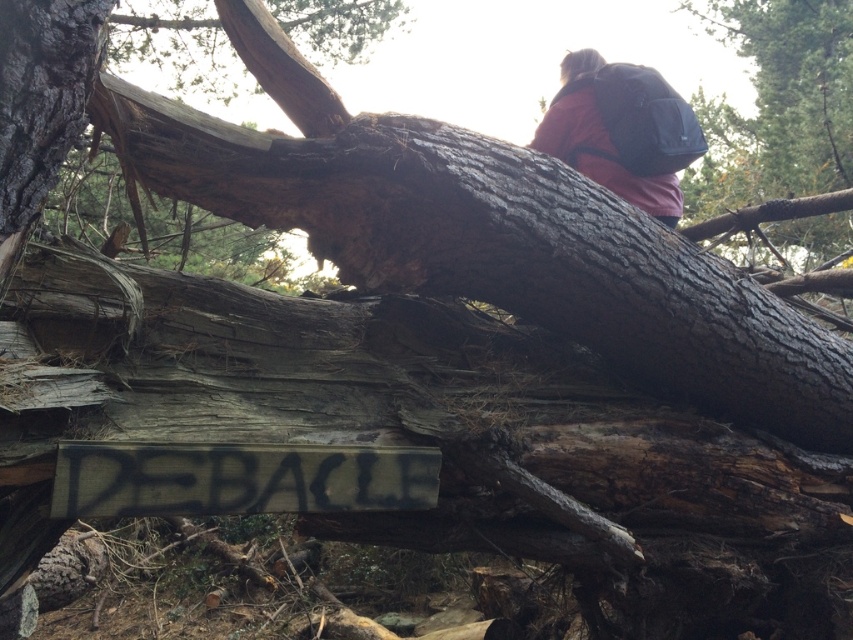
Question: Among these points, which one is farthest from the camera?

Choices:
 (A) (544, 141)
 (B) (791, 97)

Answer: (B)

Question: Does black painted wood sign at center appear over red fabric backpack at upper right?

Choices:
 (A) yes
 (B) no

Answer: (B)

Question: Does dark brown bark at upper right appear on the right side of black painted wood sign at center?

Choices:
 (A) no
 (B) yes

Answer: (B)

Question: Based on their relative distances, which object is farther from the red fabric backpack at upper right?

Choices:
 (A) black painted wood sign at center
 (B) dark brown bark at upper right

Answer: (B)

Question: Among these points, which one is farthest from the camera?

Choices:
 (A) (782, 225)
 (B) (639, 200)

Answer: (A)

Question: Does dark brown bark at upper right appear on the left side of red fabric backpack at upper right?

Choices:
 (A) no
 (B) yes

Answer: (A)